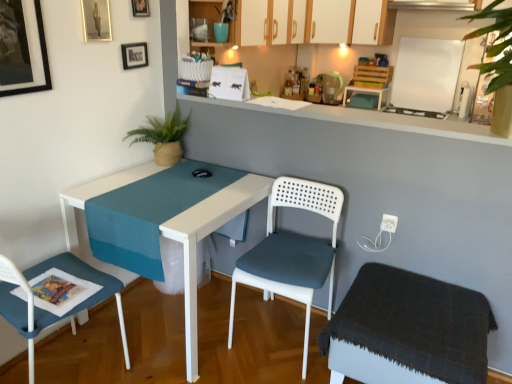
This screenshot has width=512, height=384. I want to click on vacant space in green woven plant at upper left (from a real-world perspective), so click(x=160, y=163).